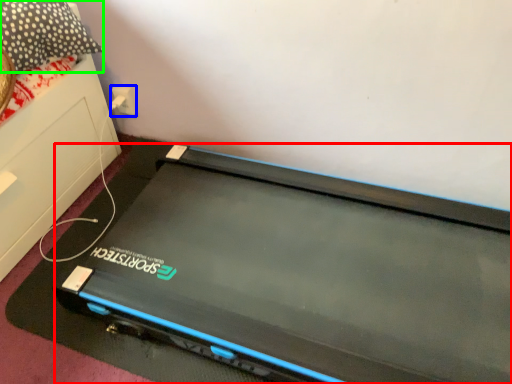
Question: Considering the real-world distances, which object is farthest from computer (highlighted by a red box)? electric outlet (highlighted by a blue box) or pillow (highlighted by a green box)?

Choices:
 (A) electric outlet
 (B) pillow

Answer: (A)